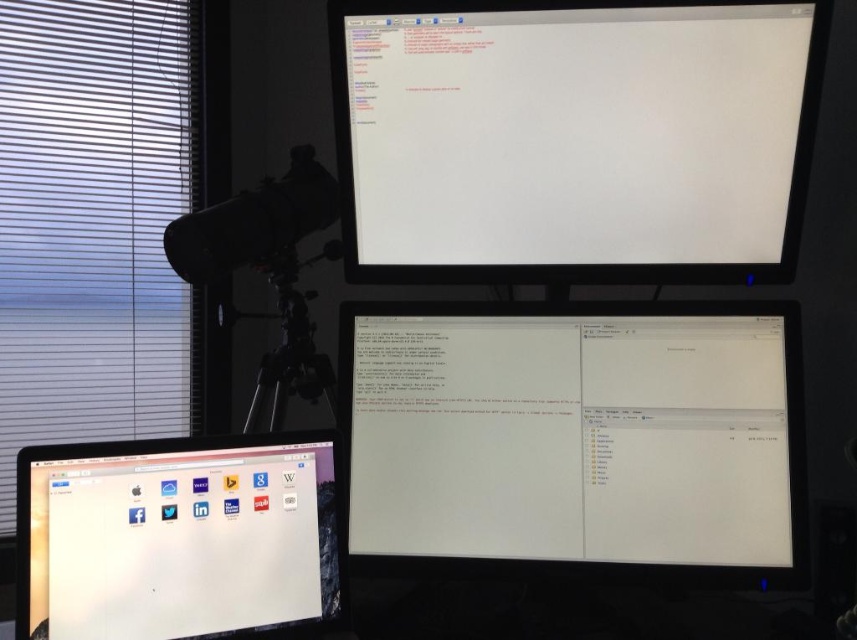
Question: Can you confirm if white glossy monitor at upper center is thinner than white matte blinds at left?

Choices:
 (A) no
 (B) yes

Answer: (A)

Question: Which object is the farthest from the matte black monitor at lower left?

Choices:
 (A) white glossy monitor at center
 (B) white glossy monitor at upper center
 (C) white matte blinds at left
 (D) black matte tripod at center

Answer: (C)

Question: Which of the following is the closest to the observer?

Choices:
 (A) matte black monitor at lower left
 (B) white matte blinds at left
 (C) black matte tripod at center

Answer: (A)

Question: Can you confirm if white glossy monitor at upper center is positioned to the right of matte black monitor at lower left?

Choices:
 (A) no
 (B) yes

Answer: (B)

Question: Considering the real-world distances, which object is farthest from the matte black monitor at lower left?

Choices:
 (A) black matte tripod at center
 (B) white matte blinds at left

Answer: (B)

Question: Is white glossy monitor at upper center behind white matte blinds at left?

Choices:
 (A) no
 (B) yes

Answer: (A)